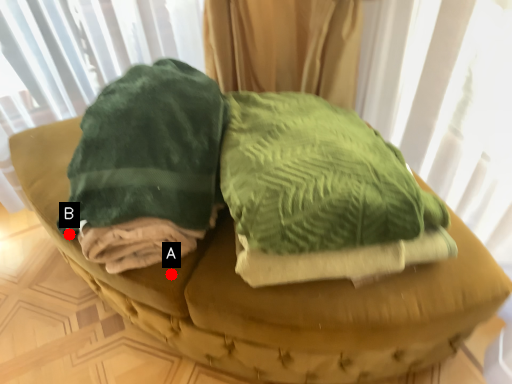
Question: Two points are circled on the image, labeled by A and B beside each circle. Which point is closer to the camera?

Choices:
 (A) A is closer
 (B) B is closer

Answer: (A)